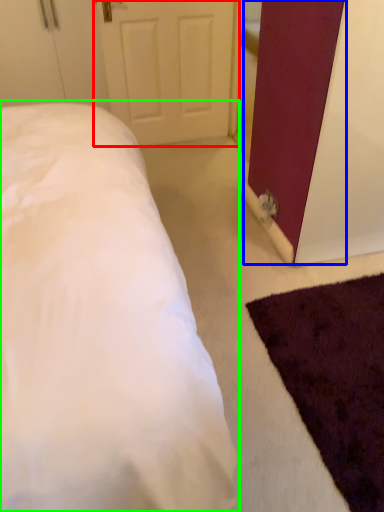
Question: Estimate the real-world distances between objects in this image. Which object is farther from door (highlighted by a red box), barn door (highlighted by a blue box) or bed (highlighted by a green box)?

Choices:
 (A) barn door
 (B) bed

Answer: (B)